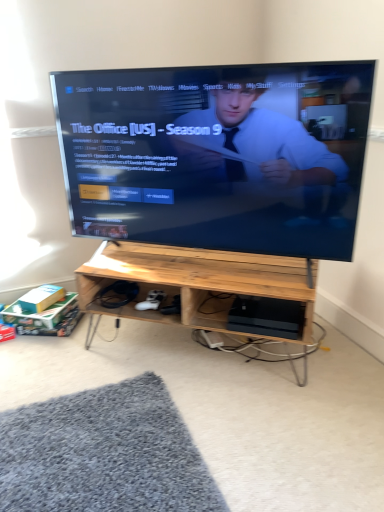
Image resolution: width=384 pixels, height=512 pixels. Identify the location of free space that is to the left of natural wood desk at center. (66, 372).